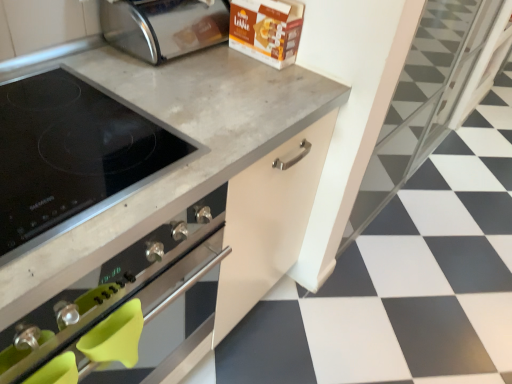
The height and width of the screenshot is (384, 512). What do you see at coordinates (163, 26) in the screenshot?
I see `polished stainless steel toaster at upper center` at bounding box center [163, 26].

What is the approximate width of black glass cooktop at upper left?

It is 20.67 inches.

What do you see at coordinates (405, 281) in the screenshot? The image size is (512, 384). I see `white glossy tile at center` at bounding box center [405, 281].

Find the location of `polished stainless steel toaster at upper center`. polished stainless steel toaster at upper center is located at coordinates [163, 26].

Is white glossy tile at center wider than polished stainless steel toaster at upper center?

Correct, the width of white glossy tile at center exceeds that of polished stainless steel toaster at upper center.

Is white glossy tile at center inside the boundaries of polished stainless steel toaster at upper center, or outside?

white glossy tile at center is spatially situated outside polished stainless steel toaster at upper center.

Is white glossy tile at center in front of polished stainless steel toaster at upper center?

Yes.

How different are the orientations of white glossy tile at center and polished stainless steel toaster at upper center in degrees?

There is a 89.8-degree angle between the facing directions of white glossy tile at center and polished stainless steel toaster at upper center.

Can black glass cooktop at upper left be found inside polished stainless steel toaster at upper center?

No, black glass cooktop at upper left is not inside polished stainless steel toaster at upper center.

From the image's perspective, relative to black glass cooktop at upper left, is polished stainless steel toaster at upper center above or below?

polished stainless steel toaster at upper center is above black glass cooktop at upper left.

Consider the image. Would you say polished stainless steel toaster at upper center is a long distance from black glass cooktop at upper left?

No.

Is point (140, 57) positioned in front of point (18, 256)?

That is False.

Considering the positions of points (91, 150) and (259, 114), is point (91, 150) closer to camera compared to point (259, 114)?

Yes.

Is black matte stovetop at center surrounded by black glass cooktop at upper left?

Actually, black matte stovetop at center is outside black glass cooktop at upper left.

Can you confirm if black glass cooktop at upper left is shorter than black matte stovetop at center?

Yes, black glass cooktop at upper left is shorter than black matte stovetop at center.

Identify the location of kitchen appliance in front of the white glossy tile at center. The height and width of the screenshot is (384, 512). (73, 155).

In terms of width, does white glossy tile at center look wider or thinner when compared to black glass cooktop at upper left?

In the image, white glossy tile at center appears to be wider than black glass cooktop at upper left.

From a real-world perspective, which is physically above, white glossy tile at center or black glass cooktop at upper left?

black glass cooktop at upper left.

How many degrees apart are the facing directions of white glossy tile at center and black glass cooktop at upper left?

The angular difference between white glossy tile at center and black glass cooktop at upper left is 89.8 degrees.

From a real-world perspective, which object rests below the other?

From a 3D spatial view, white glossy tile at center is below.

From the image's perspective, is polished stainless steel toaster at upper center over white glossy tile at center?

Yes, from the image's perspective, polished stainless steel toaster at upper center is on top of white glossy tile at center.

Considering the sizes of objects polished stainless steel toaster at upper center and white glossy tile at center in the image provided, who is shorter, polished stainless steel toaster at upper center or white glossy tile at center?

With less height is white glossy tile at center.

Which is less distant, (181,40) or (420,222)?

Clearly, point (181,40) is closer to the camera than point (420,222).

From the picture: Is black matte stovetop at center far from white glossy tile at center?

black matte stovetop at center is near white glossy tile at center, not far away.

From the image's perspective, is black matte stovetop at center below white glossy tile at center?

Yes, from the image's perspective, black matte stovetop at center is below white glossy tile at center.

How different are the orientations of black matte stovetop at center and white glossy tile at center in degrees?

They differ by 89.8 degrees in their facing directions.

Between black matte stovetop at center and white glossy tile at center, which one has smaller size?

white glossy tile at center is smaller.

Which is more to the left, black matte stovetop at center or black glass cooktop at upper left?

From the viewer's perspective, black matte stovetop at center appears more on the left side.

Is black glass cooktop at upper left located within black matte stovetop at center?

No.

Is black matte stovetop at center bigger or smaller than black glass cooktop at upper left?

Clearly, black matte stovetop at center is larger in size than black glass cooktop at upper left.

Where is `tile that is under the polished stainless steel toaster at upper center (from a real-world perspective)`? The height and width of the screenshot is (384, 512). tile that is under the polished stainless steel toaster at upper center (from a real-world perspective) is located at coordinates (405, 281).

Identify the location of toaster on the right side of black glass cooktop at upper left. This screenshot has height=384, width=512. (163, 26).

Looking at the image, which one is located further to polished stainless steel toaster at upper center, black glass cooktop at upper left or white glossy tile at center?

The object further to polished stainless steel toaster at upper center is white glossy tile at center.

Which object lies nearer to the anchor point black matte stovetop at center, black glass cooktop at upper left or white glossy tile at center?

black glass cooktop at upper left.

When comparing their distances from black glass cooktop at upper left, does white glossy tile at center or polished stainless steel toaster at upper center seem closer?

Based on the image, polished stainless steel toaster at upper center appears to be nearer to black glass cooktop at upper left.

Which object lies further to the anchor point polished stainless steel toaster at upper center, white glossy tile at center or black glass cooktop at upper left?

The object further to polished stainless steel toaster at upper center is white glossy tile at center.

When comparing their distances from white glossy tile at center, does black glass cooktop at upper left or black matte stovetop at center seem further?

black glass cooktop at upper left is positioned further to the anchor white glossy tile at center.

When comparing their distances from black glass cooktop at upper left, does polished stainless steel toaster at upper center or black matte stovetop at center seem closer?

The object closer to black glass cooktop at upper left is black matte stovetop at center.

When comparing their distances from black matte stovetop at center, does white glossy tile at center or polished stainless steel toaster at upper center seem closer?

polished stainless steel toaster at upper center is closer to black matte stovetop at center.

From the image, which object appears to be nearer to black matte stovetop at center, polished stainless steel toaster at upper center or black glass cooktop at upper left?

black glass cooktop at upper left.

Where is `kitchen appliance between polished stainless steel toaster at upper center and black matte stovetop at center from top to bottom`? The image size is (512, 384). kitchen appliance between polished stainless steel toaster at upper center and black matte stovetop at center from top to bottom is located at coordinates (73, 155).

Find the location of a particular element. toaster located between black matte stovetop at center and white glossy tile at center in the left-right direction is located at coordinates (163, 26).

Identify the location of kitchen appliance between black matte stovetop at center and white glossy tile at center. The height and width of the screenshot is (384, 512). (73, 155).

This screenshot has height=384, width=512. Find the location of `toaster between black glass cooktop at upper left and white glossy tile at center in the horizontal direction`. toaster between black glass cooktop at upper left and white glossy tile at center in the horizontal direction is located at coordinates (163, 26).